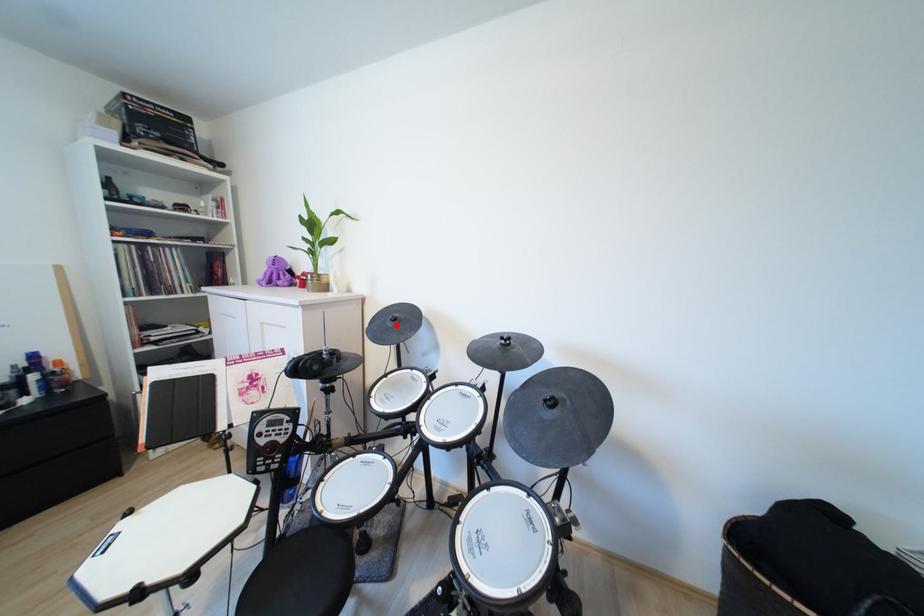
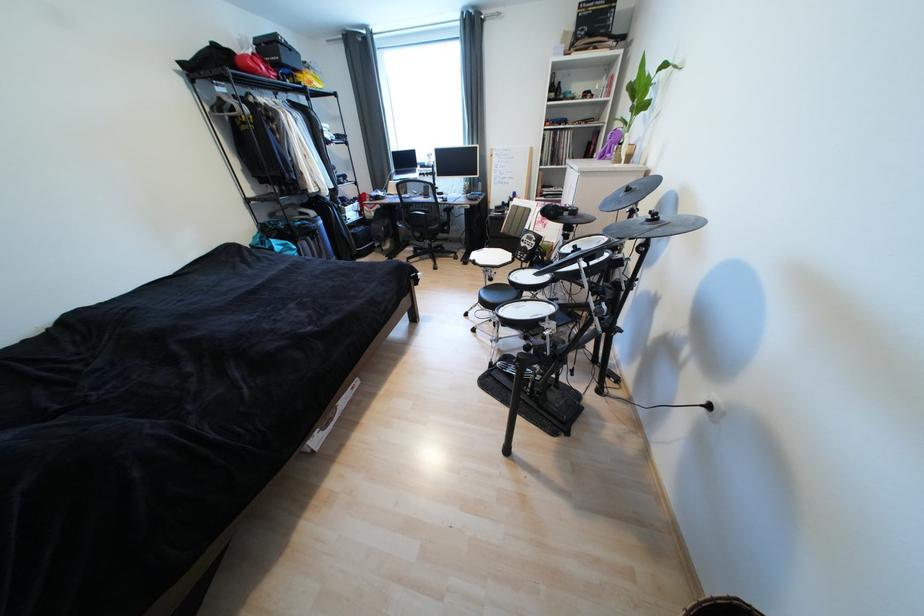
Question: I am providing you with two images of the same scene from different viewpoints. Image1 has a red point marked. In image2, the corresponding 3D location appears at what relative position? Reply with the corresponding letter.

Choices:
 (A) Closer
 (B) Farther

Answer: (A)